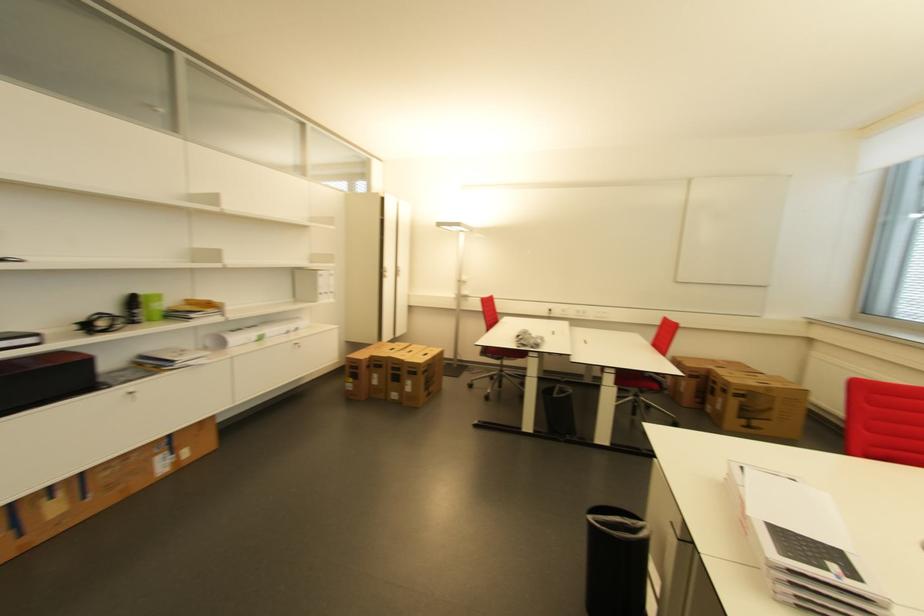
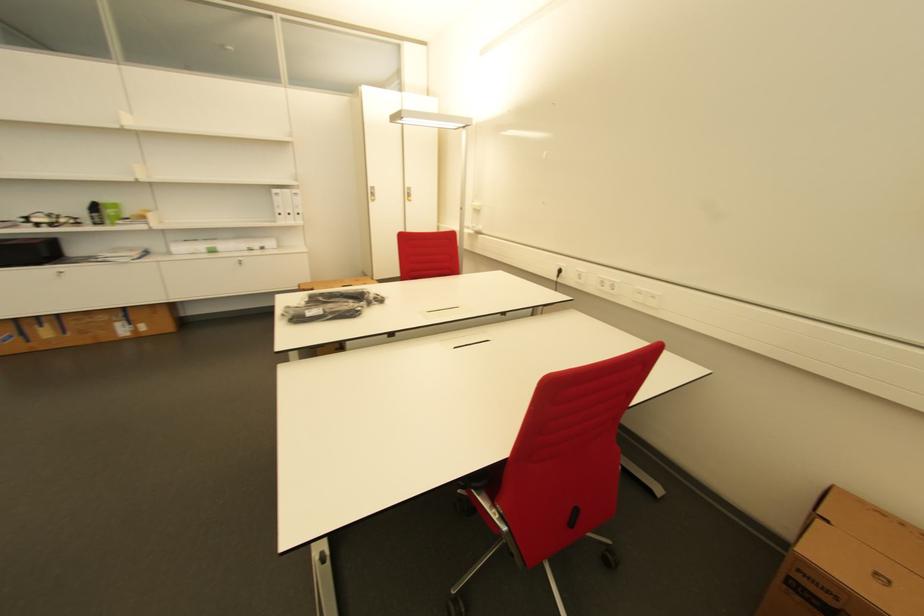
Where in the second image is the point corresponding to point (147, 301) from the first image?

(104, 208)